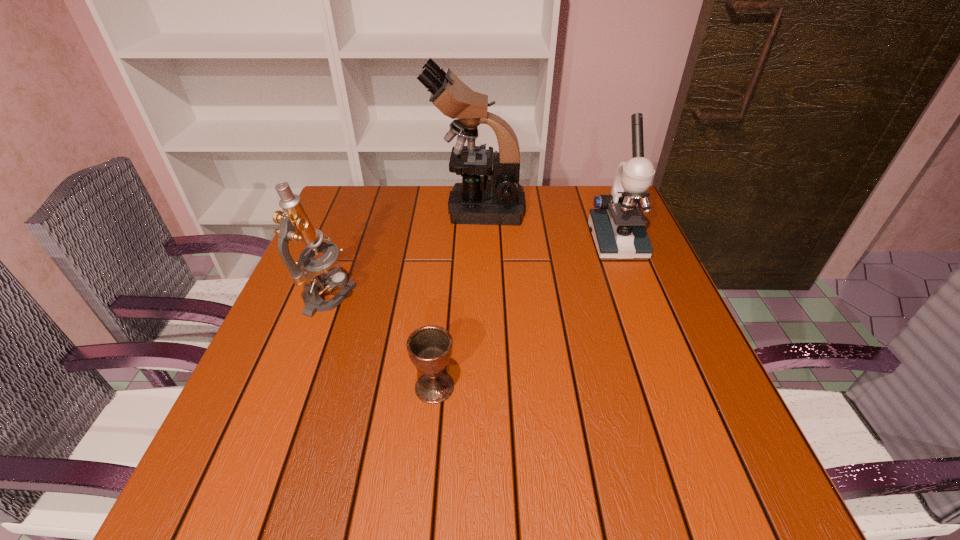
Find the location of a particular element. This screenshot has width=960, height=540. the third closest object relative to the rightmost object is located at coordinates (295, 225).

Identify the location of object that is the third nearest to the rightmost object. (295, 225).

Identify which microscope is the second nearest to the rightmost microscope. Please provide its 2D coordinates. Your answer should be formatted as a tuple, i.e. [(x, y)], where the tuple contains the x and y coordinates of a point satisfying the conditions above.

[(295, 225)]

Image resolution: width=960 pixels, height=540 pixels. In order to click on the closest microscope relative to the second microscope from left to right in this screenshot , I will do `click(618, 228)`.

Identify the location of free location that satisfies the following two spatial constraints: 1. on the back side of the shortest object; 2. on the right side of the second microscope from right to left. The height and width of the screenshot is (540, 960). (451, 209).

This screenshot has height=540, width=960. In order to click on vacant point that satisfies the following two spatial constraints: 1. on the back side of the third farthest object; 2. on the left side of the rightmost microscope in this screenshot , I will do `click(350, 241)`.